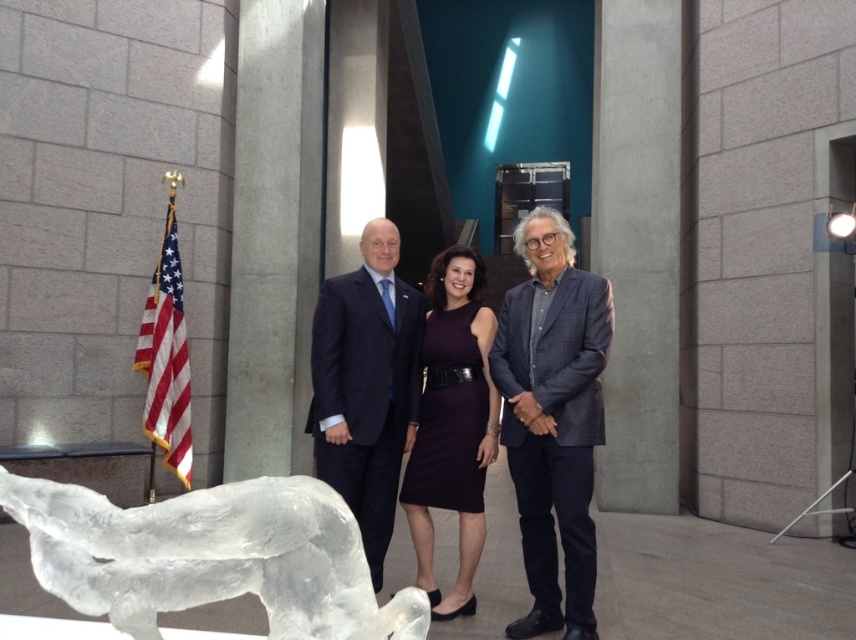
Does purple satin dress at center have a lesser height compared to red fabric flag at left?

Yes, purple satin dress at center is shorter than red fabric flag at left.

Can you confirm if purple satin dress at center is positioned below red fabric flag at left?

Yes, purple satin dress at center is below red fabric flag at left.

Who is more distant from viewer, (428, 561) or (153, 380)?

Positioned behind is point (153, 380).

Locate an element on the screen. purple satin dress at center is located at coordinates (452, 424).

Can you confirm if blue plaid blazer at center is bigger than dark blue pinstripe suit at center?

Yes.

Is blue plaid blazer at center to the right of dark blue pinstripe suit at center from the viewer's perspective?

Yes, blue plaid blazer at center is to the right of dark blue pinstripe suit at center.

Is point (589, 445) in front of point (376, 356)?

Yes, it is in front of point (376, 356).

The width and height of the screenshot is (856, 640). What are the coordinates of `blue plaid blazer at center` in the screenshot? It's located at (551, 417).

Is the position of dark blue pinstripe suit at center more distant than that of red fabric flag at left?

That is False.

Does point (308, 426) come in front of point (179, 262)?

Yes.

Image resolution: width=856 pixels, height=640 pixels. I want to click on dark blue pinstripe suit at center, so click(x=366, y=385).